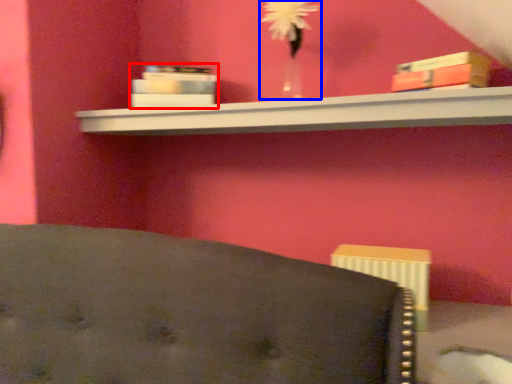
Question: Which object is further to the camera taking this photo, book (highlighted by a red box) or floral arrangement (highlighted by a blue box)?

Choices:
 (A) book
 (B) floral arrangement

Answer: (A)